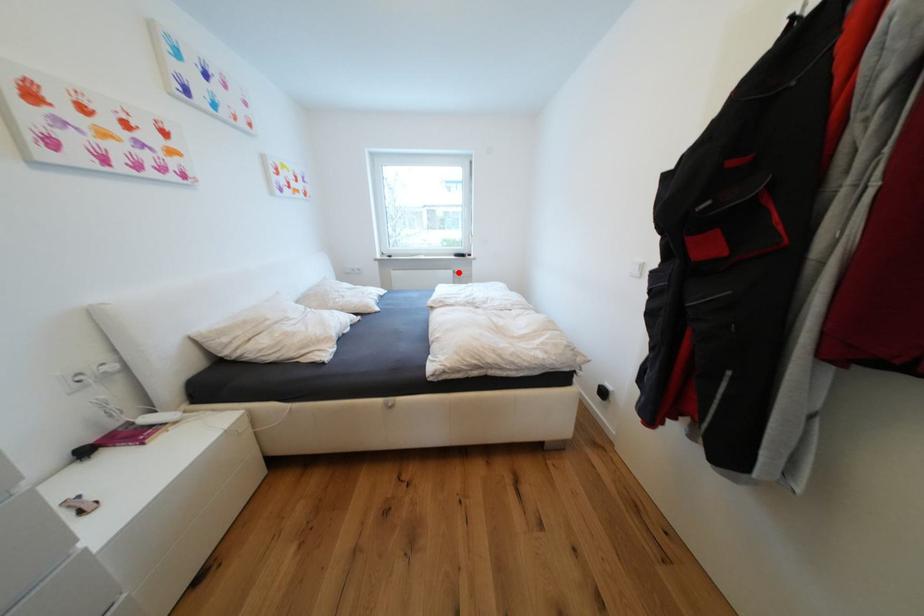
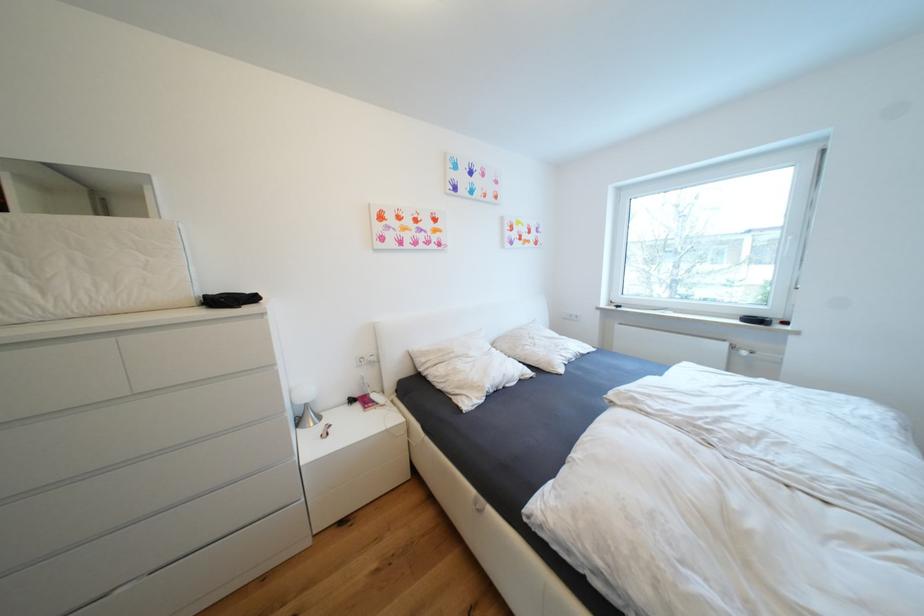
Question: I am providing you with two images of the same scene from different viewpoints. Image1 has a red point marked. In image2, the corresponding 3D location appears at what relative position? Reply with the corresponding letter.

Choices:
 (A) Closer
 (B) Farther

Answer: (B)